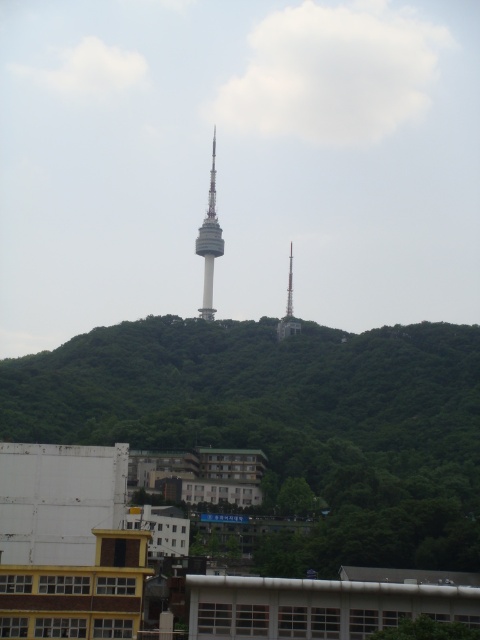
Who is shorter, green leafy hillside at center or gray concrete tower at center?

Standing shorter between the two is green leafy hillside at center.

Between green leafy hillside at center and gray concrete tower at center, which one appears on the right side from the viewer's perspective?

green leafy hillside at center

Is point (386, 360) less distant than point (211, 173)?

Yes, point (386, 360) is closer to viewer.

Identify the location of green leafy hillside at center. (287, 422).